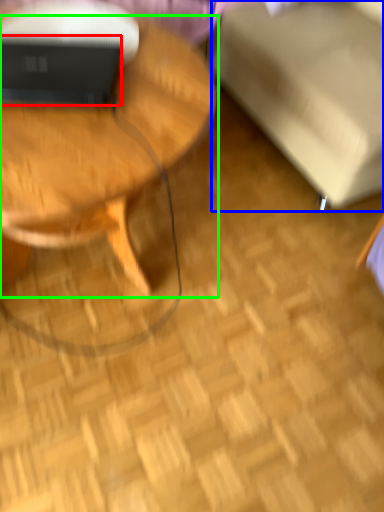
Question: Which object is the closest to the laptop (highlighted by a red box)? Choose among these: swivel chair (highlighted by a blue box) or coffee table (highlighted by a green box).

Choices:
 (A) swivel chair
 (B) coffee table

Answer: (B)